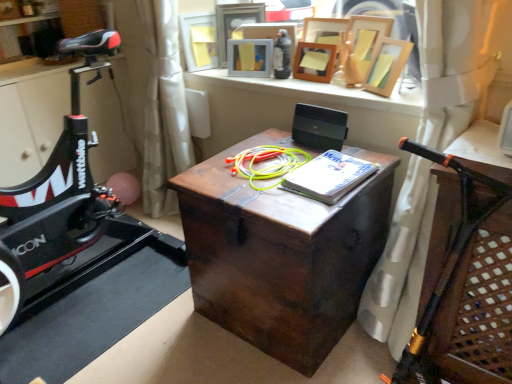
In order to click on vacant space in front of matte plastic picture frame at upper center, the 3th picture frame from the left in this screenshot , I will do `click(256, 81)`.